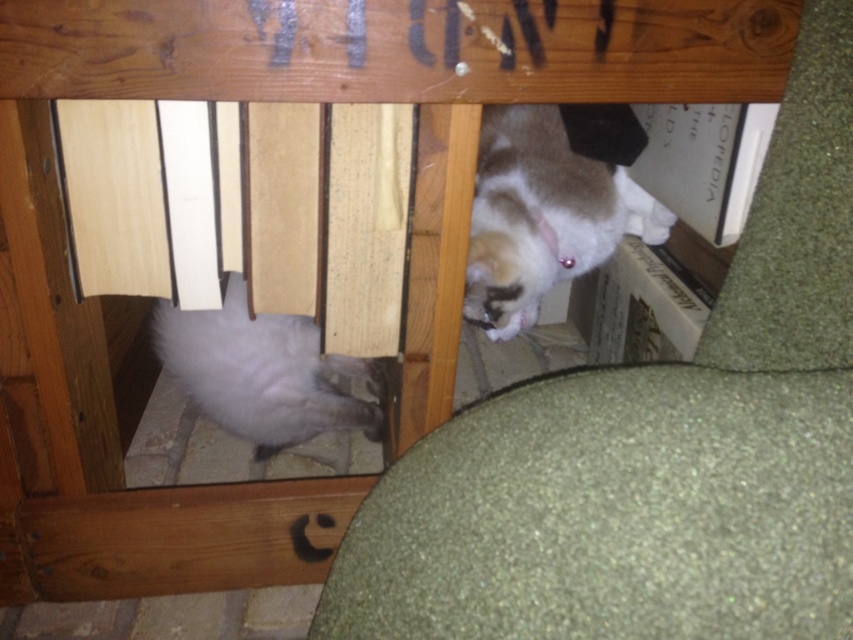
You are a photographer trying to capture both cats in the scene. Since the fuzzy fur cat at lower left is wider than the fuzzy white cat at upper right, which cat should you position closer to the center of the frame to ensure both fit comfortably within the shot?

Position the fuzzy fur cat at lower left closer to the center of the frame since it is wider, allowing more space for the smaller fuzzy white cat at upper right to fit comfortably within the shot.